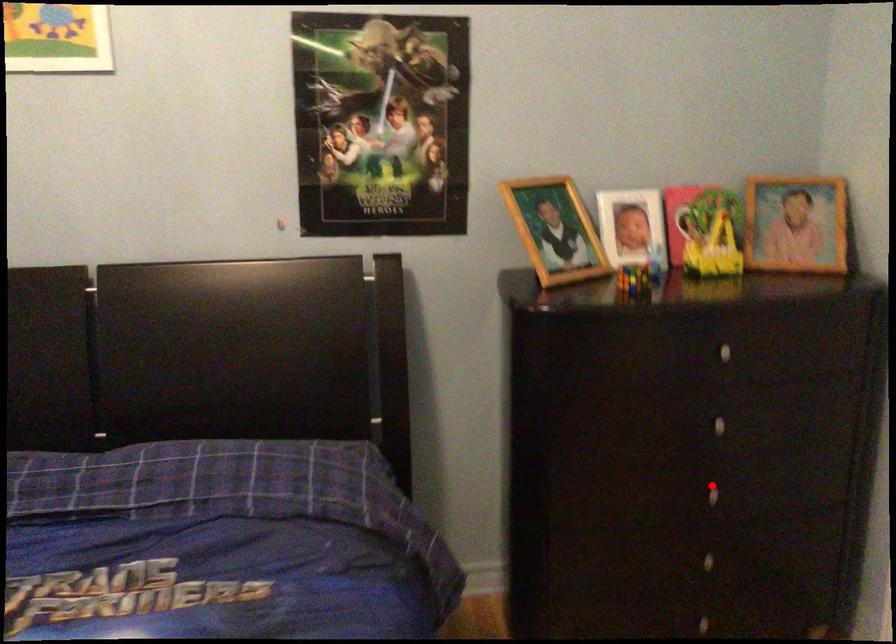
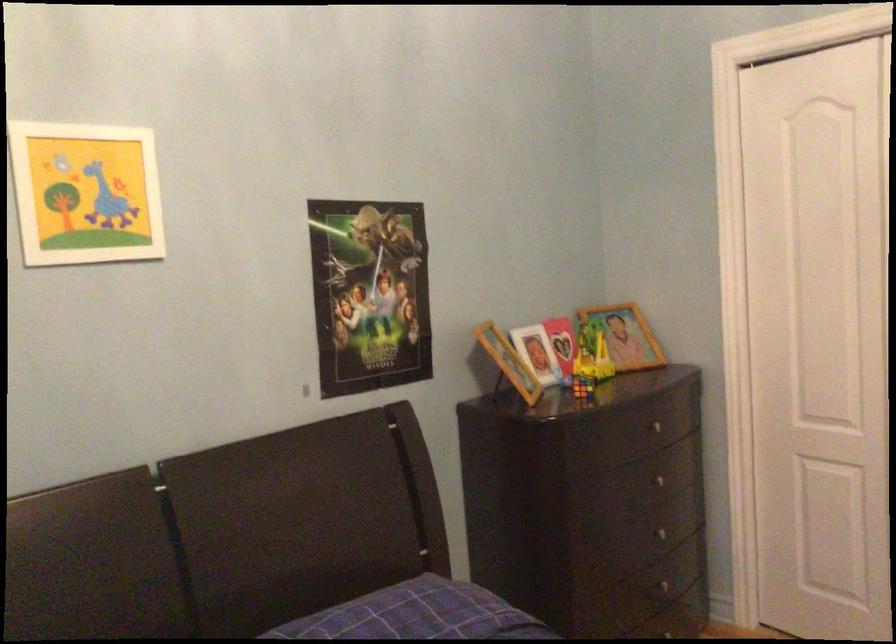
Locate, in the second image, the point that corresponds to the highlighted location in the first image.

(667, 532)